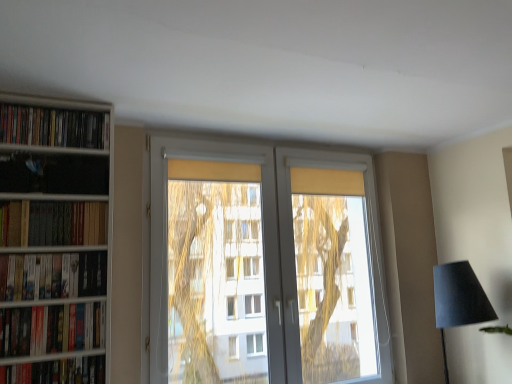
Measure the distance between point (89, 344) and camera.

A distance of 1.92 meters exists between point (89, 344) and camera.

You are a GUI agent. You are given a task and a screenshot of the screen. Output one action in this format:
    pyautogui.click(x=<x>, y=<y>)
    Task: Click on the wooden bookshelf at left
    
    Given the screenshot: What is the action you would take?
    pyautogui.click(x=55, y=240)

Describe the element at coordinates (55, 240) in the screenshot. I see `wooden bookshelf at left` at that location.

You are a GUI agent. You are given a task and a screenshot of the screen. Output one action in this format:
    pyautogui.click(x=<x>, y=<y>)
    Task: Click on the matte black lampshade at lower right
    
    Given the screenshot: What is the action you would take?
    pyautogui.click(x=458, y=300)

Where is `white plastic window at center`? white plastic window at center is located at coordinates (264, 266).

Image resolution: width=512 pixels, height=384 pixels. Describe the element at coordinates (56, 372) in the screenshot. I see `hardcover book at lower left, the first book in the bottom-to-top sequence` at that location.

Identify the location of hardcover books at left, the 2th book when ordered from bottom to top. (52, 329).

Consider the image. Is matte black lampshade at lower right directly adjacent to matte black bookshelf at left, positioned as the third book in bottom-to-top order?

They are not placed beside each other.

Which is closer, (494,319) or (12,281)?

Point (12,281)

In terms of height, does matte black lampshade at lower right look taller or shorter compared to matte black bookshelf at left, which appears as the third book when viewed from the top?

Clearly, matte black lampshade at lower right is taller compared to matte black bookshelf at left, which appears as the third book when viewed from the top.

Are white plastic window at center and hardcover books at left, which is counted as the 2th book, starting from the top, far apart?

No.

I want to click on window behind the hardcover books at left, which appears as the fourth book when ordered from the bottom, so click(x=264, y=266).

Choose the correct answer: Is white plastic window at center inside hardcover books at left, which is counted as the 2th book, starting from the top, or outside it?

The correct answer is: outside.

Considering the sizes of objects white plastic window at center and hardcover books at left, which appears as the fourth book when ordered from the bottom, in the image provided, who is bigger, white plastic window at center or hardcover books at left, which appears as the fourth book when ordered from the bottom,?

white plastic window at center.

Considering the sizes of objects hardcover books at left, which is counted as the 2th book, starting from the top, and wooden bookshelf at left in the image provided, who is wider, hardcover books at left, which is counted as the 2th book, starting from the top, or wooden bookshelf at left?

With larger width is wooden bookshelf at left.

Is hardcover books at left, which appears as the fourth book when ordered from the bottom, oriented towards wooden bookshelf at left?

Yes.

From the image's perspective, is hardcover books at left, which is counted as the 2th book, starting from the top, located above or below wooden bookshelf at left?

hardcover books at left, which is counted as the 2th book, starting from the top, is above wooden bookshelf at left.

Does matte black lampshade at lower right appear on the left side of hardcover book at lower left, which appears as the 5th book when viewed from the top?

No.

Identify the location of table lamp behind the hardcover book at lower left, the first book in the bottom-to-top sequence. (458, 300).

Which is in front, matte black lampshade at lower right or hardcover book at lower left, the first book in the bottom-to-top sequence?

Positioned in front is hardcover book at lower left, the first book in the bottom-to-top sequence.

Based on the photo, from the image's perspective, is matte black lampshade at lower right above or below hardcover book at lower left, the first book in the bottom-to-top sequence?

From the image's perspective, matte black lampshade at lower right appears above hardcover book at lower left, the first book in the bottom-to-top sequence.

Is hardcover book at lower left, the first book in the bottom-to-top sequence, outside of white plastic window at center?

hardcover book at lower left, the first book in the bottom-to-top sequence, is positioned outside white plastic window at center.

Based on the photo, from a real-world perspective, is hardcover book at lower left, the first book in the bottom-to-top sequence, located higher than white plastic window at center?

No, from a real-world perspective, hardcover book at lower left, the first book in the bottom-to-top sequence, is not above white plastic window at center.

Between hardcover book at lower left, the first book in the bottom-to-top sequence, and white plastic window at center, which one has larger width?

hardcover book at lower left, the first book in the bottom-to-top sequence, is wider.

Considering the positions of objects hardcover book at lower left, which appears as the 5th book when viewed from the top, and white plastic window at center in the image provided, who is more to the left, hardcover book at lower left, which appears as the 5th book when viewed from the top, or white plastic window at center?

From the viewer's perspective, hardcover book at lower left, which appears as the 5th book when viewed from the top, appears more on the left side.

Does hardcover books at left, which is counted as the 2th book, starting from the top, contain hardcover book at lower left, the first book in the bottom-to-top sequence?

No.

Which point is more distant from viewer, (57, 221) or (46, 374)?

The point (57, 221) is farther.

Can you confirm if hardcover books at left, which is counted as the 2th book, starting from the top, is bigger than hardcover book at lower left, which appears as the 5th book when viewed from the top?

Yes.

Considering the sizes of objects hardcover books at left, the 2th book when ordered from bottom to top, and matte black bookshelf at left, positioned as the third book in bottom-to-top order, in the image provided, who is smaller, hardcover books at left, the 2th book when ordered from bottom to top, or matte black bookshelf at left, positioned as the third book in bottom-to-top order,?

Smaller between the two is matte black bookshelf at left, positioned as the third book in bottom-to-top order.

Considering the positions of point (84, 349) and point (46, 276), is point (84, 349) closer or farther from the camera than point (46, 276)?

Point (84, 349) is positioned farther from the camera compared to point (46, 276).

Can you confirm if hardcover books at left, which is the 4th book in top-to-bottom order, is positioned to the left of matte black bookshelf at left, positioned as the third book in bottom-to-top order?

No.

How many degrees apart are the facing directions of hardcover books at left, which is the 4th book in top-to-bottom order, and matte black bookshelf at left, positioned as the third book in bottom-to-top order?

0.000889 degrees separate the facing orientations of hardcover books at left, which is the 4th book in top-to-bottom order, and matte black bookshelf at left, positioned as the third book in bottom-to-top order.

You are a GUI agent. You are given a task and a screenshot of the screen. Output one action in this format:
    pyautogui.click(x=<x>, y=<y>)
    Task: Click on the book that is the 3rd one when counting forward from the matte black lampshade at lower right
    The image size is (512, 384).
    Given the screenshot: What is the action you would take?
    pyautogui.click(x=52, y=276)

Where is `the 2nd book positioned above the white plastic window at center (from a real-world perspective)`? The width and height of the screenshot is (512, 384). the 2nd book positioned above the white plastic window at center (from a real-world perspective) is located at coordinates (53, 223).

Consider the image. Considering their positions, is matte black bookshelf at left, positioned as the third book in bottom-to-top order, positioned further to matte black books at left, arranged as the 1th book when viewed from the top, than hardcover books at left, which appears as the fourth book when ordered from the bottom?

The object further to matte black books at left, arranged as the 1th book when viewed from the top, is matte black bookshelf at left, positioned as the third book in bottom-to-top order.

Based on their spatial positions, is matte black lampshade at lower right or white plastic window at center further from matte black bookshelf at left, which appears as the third book when viewed from the top?

Among the two, matte black lampshade at lower right is located further to matte black bookshelf at left, which appears as the third book when viewed from the top.

Considering their positions, is hardcover books at left, which appears as the fourth book when ordered from the bottom, positioned further to matte black lampshade at lower right than hardcover book at lower left, which appears as the 5th book when viewed from the top?

hardcover books at left, which appears as the fourth book when ordered from the bottom, is further to matte black lampshade at lower right.

Looking at the image, which one is located further to matte black bookshelf at left, which appears as the third book when viewed from the top, wooden bookshelf at left or hardcover books at left, which is the 4th book in top-to-bottom order?

wooden bookshelf at left is further to matte black bookshelf at left, which appears as the third book when viewed from the top.

When comparing their distances from matte black books at left, arranged as the 1th book when viewed from the top, does matte black bookshelf at left, positioned as the third book in bottom-to-top order, or hardcover book at lower left, the first book in the bottom-to-top sequence, seem closer?

Based on the image, matte black bookshelf at left, positioned as the third book in bottom-to-top order, appears to be nearer to matte black books at left, arranged as the 1th book when viewed from the top.

Estimate the real-world distances between objects in this image. Which object is closer to matte black books at left, arranged as the 1th book when viewed from the top, matte black lampshade at lower right or hardcover books at left, which is counted as the 2th book, starting from the top?

hardcover books at left, which is counted as the 2th book, starting from the top.

From the image, which object appears to be farther from white plastic window at center, matte black lampshade at lower right or hardcover books at left, which appears as the fourth book when ordered from the bottom?

hardcover books at left, which appears as the fourth book when ordered from the bottom, lies further to white plastic window at center than the other object.

Considering their positions, is hardcover books at left, which is the 4th book in top-to-bottom order, positioned closer to hardcover books at left, which appears as the fourth book when ordered from the bottom, than matte black books at left, arranged as the 1th book when viewed from the top?

matte black books at left, arranged as the 1th book when viewed from the top, is closer to hardcover books at left, which appears as the fourth book when ordered from the bottom.

Identify the location of window between matte black books at left, the fifth book positioned from the bottom, and matte black lampshade at lower right, in the horizontal direction. The height and width of the screenshot is (384, 512). (264, 266).

Image resolution: width=512 pixels, height=384 pixels. Find the location of `book between matte black books at left, the fifth book positioned from the bottom, and wooden bookshelf at left in the up-down direction`. book between matte black books at left, the fifth book positioned from the bottom, and wooden bookshelf at left in the up-down direction is located at coordinates (53, 223).

Identify the location of bookcase between matte black books at left, the fifth book positioned from the bottom, and white plastic window at center, in the horizontal direction. This screenshot has height=384, width=512. (55, 240).

In order to click on bookcase between hardcover books at left, which is counted as the 2th book, starting from the top, and hardcover book at lower left, which appears as the 5th book when viewed from the top, in the up-down direction in this screenshot , I will do `click(55, 240)`.